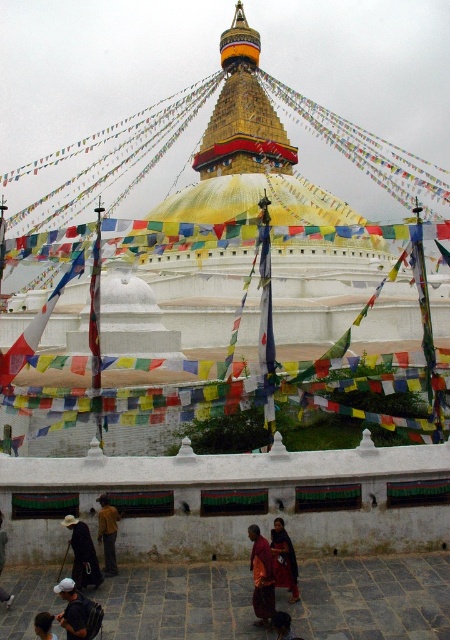
Which is more to the left, gold/yellow/golden metallic spire at center or red fabric dress at center?

gold/yellow/golden metallic spire at center is more to the left.

Is gold/yellow/golden metallic spire at center in front of red fabric dress at center?

No, it is not.

This screenshot has width=450, height=640. What do you see at coordinates (243, 113) in the screenshot?
I see `gold/yellow/golden metallic spire at center` at bounding box center [243, 113].

Identify the location of gold/yellow/golden metallic spire at center. (243, 113).

Who is more forward, (66, 621) or (84, 524)?

Point (66, 621) is in front.

Is point (72, 634) in front of point (68, 525)?

Yes, point (72, 634) is in front of point (68, 525).

Find the location of `dark gray backpack at lower left`. dark gray backpack at lower left is located at coordinates (77, 611).

Does gold/yellow/golden metallic spire at center appear on the right side of dark brown leather jacket at lower left?

Yes, gold/yellow/golden metallic spire at center is to the right of dark brown leather jacket at lower left.

Does gold/yellow/golden metallic spire at center appear on the left side of dark brown leather jacket at lower left?

Incorrect, gold/yellow/golden metallic spire at center is not on the left side of dark brown leather jacket at lower left.

Where is `gold/yellow/golden metallic spire at center`? gold/yellow/golden metallic spire at center is located at coordinates (243, 113).